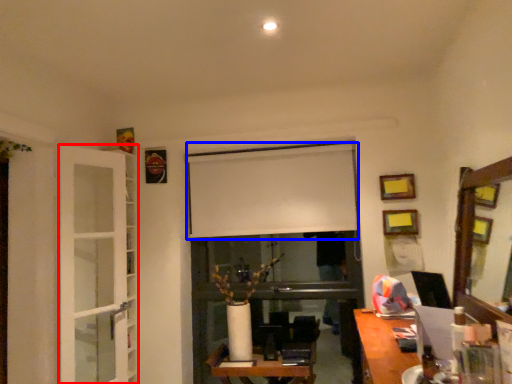
Question: Which of the following is the closest to the observer, glass door (highlighted by a red box) or window screen (highlighted by a blue box)?

Choices:
 (A) glass door
 (B) window screen

Answer: (A)